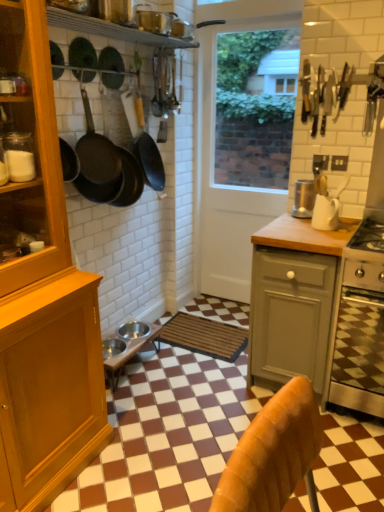
At what (x,y) coordinates should I click in order to perform the action: click on free space in front of white matte mug at upper right, the 2th kitchen appliance positioned from the back. Please return your answer as a coordinate pair (x, y). This screenshot has height=512, width=384. Looking at the image, I should click on (336, 232).